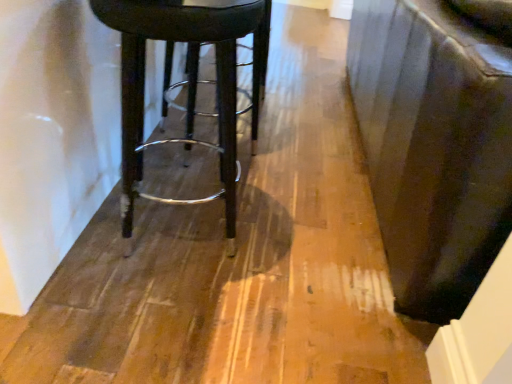
The height and width of the screenshot is (384, 512). Identify the location of free point below matte black stool at center (from a real-world perspective). (203, 230).